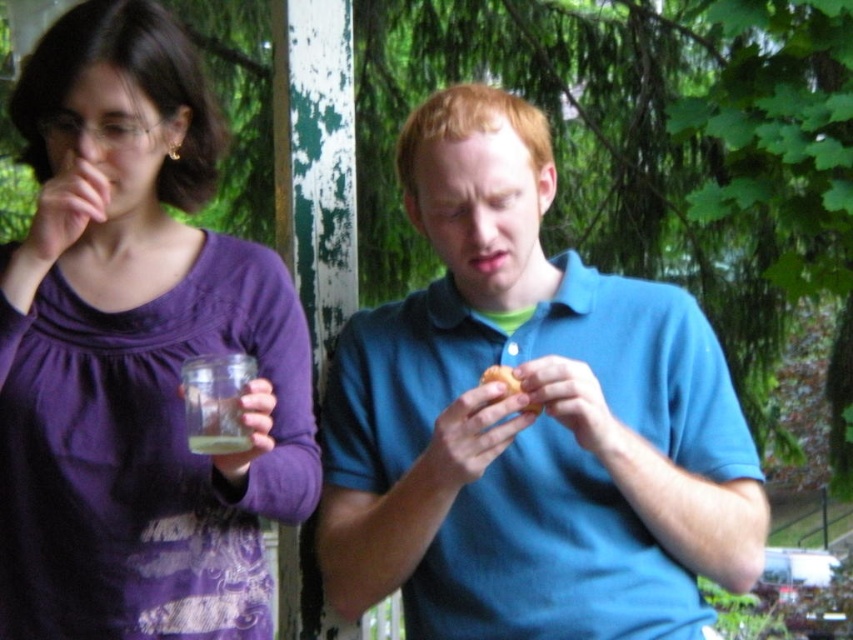
Does purple matte shirt at upper left appear on the right side of yellow matte donut at center?

No, purple matte shirt at upper left is not to the right of yellow matte donut at center.

Which is below, purple matte shirt at upper left or yellow matte donut at center?

yellow matte donut at center is below.

Between point (128, 496) and point (508, 365), which one is positioned in front?

Positioned in front is point (128, 496).

Where is `purple matte shirt at upper left`? purple matte shirt at upper left is located at coordinates (136, 353).

Is blue cotton shirt at center below purple matte shirt at upper left?

Correct, blue cotton shirt at center is located below purple matte shirt at upper left.

Which of these two, blue cotton shirt at center or purple matte shirt at upper left, stands taller?

purple matte shirt at upper left is taller.

Who is more distant from viewer, (387,529) or (119,216)?

The point (119,216) is more distant.

Locate an element on the screen. blue cotton shirt at center is located at coordinates (527, 419).

Can you confirm if blue cotton shirt at center is positioned above yellow matte donut at center?

Correct, blue cotton shirt at center is located above yellow matte donut at center.

From the picture: Can you confirm if blue cotton shirt at center is shorter than yellow matte donut at center?

No, blue cotton shirt at center is not shorter than yellow matte donut at center.

Does point (529, 188) come farther from viewer compared to point (519, 381)?

Yes, it is.

Find the location of a particular element. Image resolution: width=853 pixels, height=640 pixels. blue cotton shirt at center is located at coordinates (527, 419).